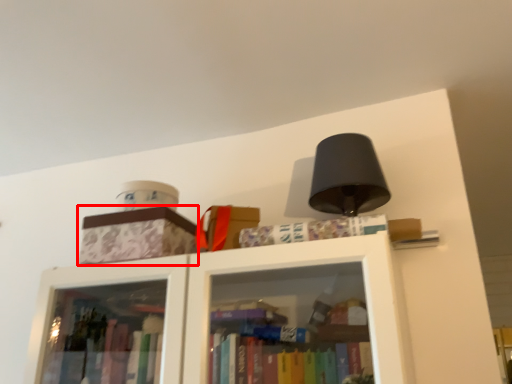
Question: Considering the relative positions of cardboard box (annotated by the red box) and book in the image provided, where is cardboard box (annotated by the red box) located with respect to the staircase?

Choices:
 (A) left
 (B) right

Answer: (A)